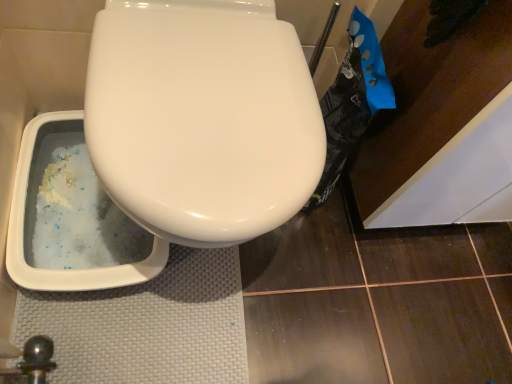
What do you see at coordinates (202, 118) in the screenshot? I see `white glossy bidet at center` at bounding box center [202, 118].

At what (x,y) coordinates should I click in order to perform the action: click on white glossy bidet at center. Please return your answer as a coordinate pair (x, y). This screenshot has width=512, height=384. Looking at the image, I should click on (202, 118).

At what (x,y) coordinates should I click in order to perform the action: click on white glossy bidet at center. Please return your answer as a coordinate pair (x, y). The width and height of the screenshot is (512, 384). Looking at the image, I should click on (202, 118).